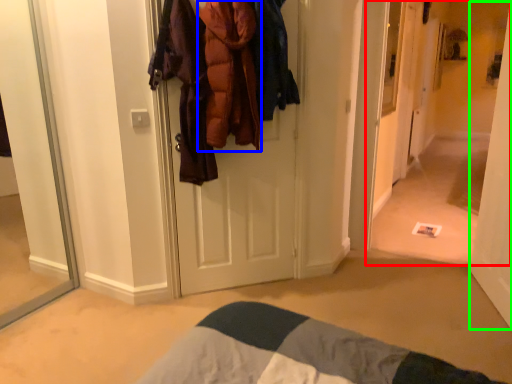
Question: Considering the real-world distances, which object is farthest from corridor (highlighted by a red box)? clothing (highlighted by a blue box) or door (highlighted by a green box)?

Choices:
 (A) clothing
 (B) door

Answer: (A)